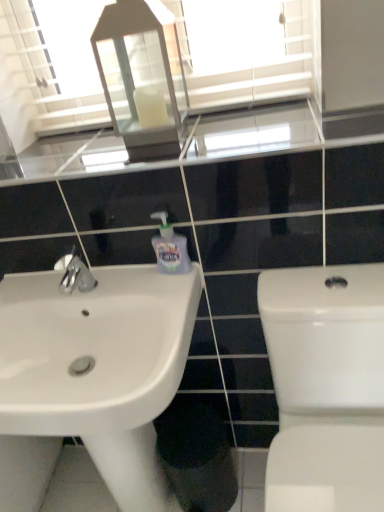
Question: Can you confirm if clear glass mirror at upper center is positioned to the right of white glossy toilet at right?

Choices:
 (A) yes
 (B) no

Answer: (B)

Question: Does clear glass mirror at upper center have a smaller size compared to white glossy toilet at right?

Choices:
 (A) yes
 (B) no

Answer: (A)

Question: From a real-world perspective, is clear glass mirror at upper center on white glossy toilet at right?

Choices:
 (A) yes
 (B) no

Answer: (A)

Question: From the image's perspective, is clear glass mirror at upper center located beneath white glossy toilet at right?

Choices:
 (A) yes
 (B) no

Answer: (B)

Question: Considering the relative sizes of clear glass mirror at upper center and white glossy toilet at right in the image provided, is clear glass mirror at upper center thinner than white glossy toilet at right?

Choices:
 (A) yes
 (B) no

Answer: (A)

Question: Considering the positions of translucent plastic soap dispenser at center and white glossy sink at lower left in the image, is translucent plastic soap dispenser at center bigger or smaller than white glossy sink at lower left?

Choices:
 (A) big
 (B) small

Answer: (B)

Question: From a real-world perspective, is translucent plastic soap dispenser at center above or below white glossy sink at lower left?

Choices:
 (A) above
 (B) below

Answer: (A)

Question: Considering the positions of translucent plastic soap dispenser at center and white glossy sink at lower left in the image, is translucent plastic soap dispenser at center wider or thinner than white glossy sink at lower left?

Choices:
 (A) wide
 (B) thin

Answer: (B)

Question: From the image's perspective, is translucent plastic soap dispenser at center above or below white glossy sink at lower left?

Choices:
 (A) below
 (B) above

Answer: (B)

Question: Considering the positions of translucent plastic soap dispenser at center and clear glass mirror at upper center in the image, is translucent plastic soap dispenser at center bigger or smaller than clear glass mirror at upper center?

Choices:
 (A) big
 (B) small

Answer: (B)

Question: From the image's perspective, relative to clear glass mirror at upper center, is translucent plastic soap dispenser at center above or below?

Choices:
 (A) above
 (B) below

Answer: (B)

Question: Considering their positions, is translucent plastic soap dispenser at center located in front of or behind clear glass mirror at upper center?

Choices:
 (A) behind
 (B) front

Answer: (A)

Question: Is point (187, 268) positioned closer to the camera than point (61, 115)?

Choices:
 (A) closer
 (B) farther

Answer: (A)

Question: From a real-world perspective, relative to white glossy sink at lower left, is white glass lantern at upper center vertically above or below?

Choices:
 (A) above
 (B) below

Answer: (A)

Question: From the image's perspective, is white glass lantern at upper center located above or below white glossy sink at lower left?

Choices:
 (A) above
 (B) below

Answer: (A)